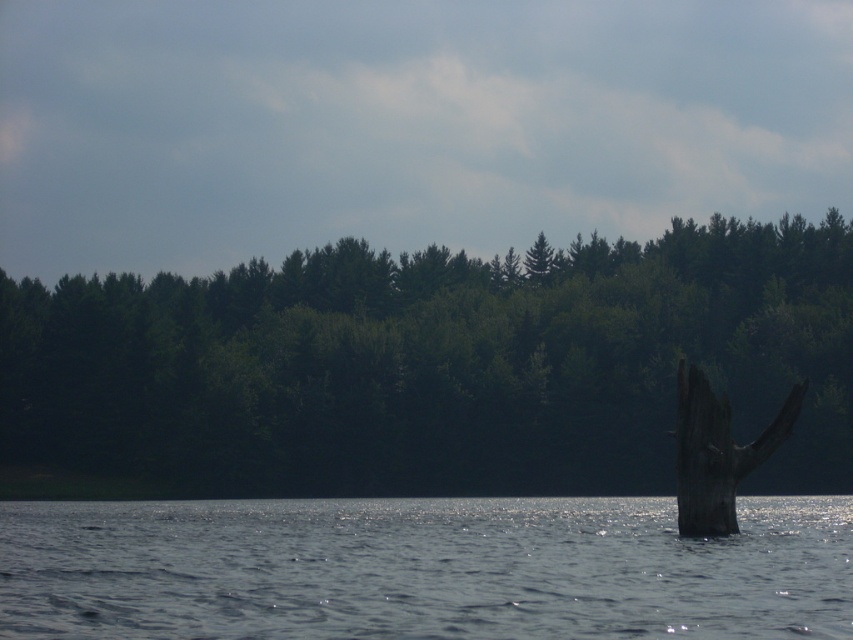
Question: Which point is farther to the camera?

Choices:
 (A) (538, 456)
 (B) (701, 378)

Answer: (A)

Question: Which point appears closest to the camera in this image?

Choices:
 (A) (692, 385)
 (B) (556, 474)
 (C) (381, 572)

Answer: (C)

Question: Which is nearer to the clear blue water at center?

Choices:
 (A) green matte forest at center
 (B) dark brown wood at right

Answer: (B)

Question: Can you confirm if green matte forest at center is bigger than clear blue water at center?

Choices:
 (A) yes
 (B) no

Answer: (A)

Question: In this image, where is green matte forest at center located relative to dark brown wood at right?

Choices:
 (A) below
 (B) above

Answer: (B)

Question: Is green matte forest at center above clear blue water at center?

Choices:
 (A) yes
 (B) no

Answer: (A)